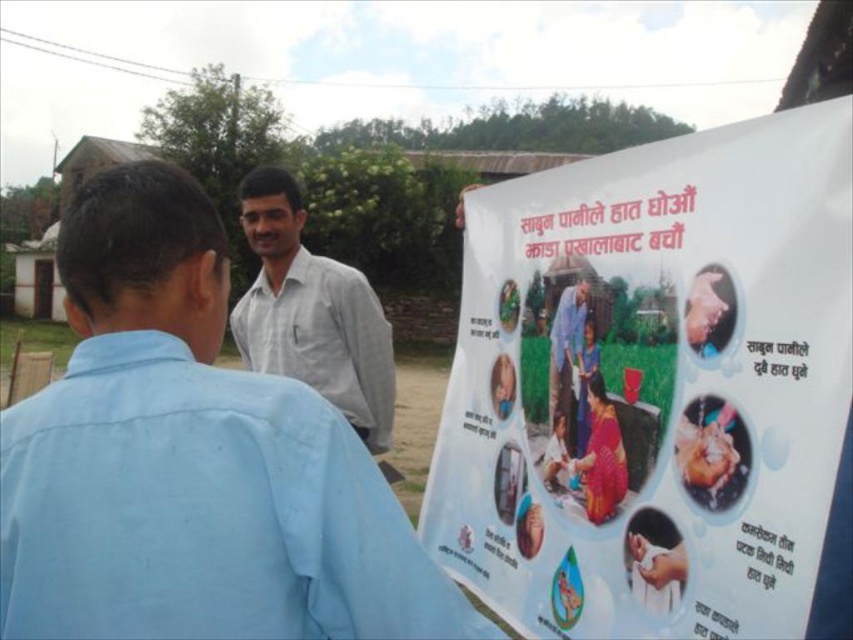
You are a photographer trying to capture both the white cotton shirt at upper center and the blue fabric shirt at center in a single frame. Which shirt should you adjust your camera angle to focus on first to ensure both are in the frame?

The white cotton shirt at upper center is wider than the blue fabric shirt at center, so you should focus on the white cotton shirt at upper center first to ensure the entire width of both shirts fits within the frame.

You are a photographer trying to capture both the white paper poster at upper right and the gray checkered shirt at center in the same frame. Based on their sizes in the image, which object would appear smaller in the photo?

The white paper poster at upper right would appear smaller in the photo because it is not as tall as the gray checkered shirt at center.